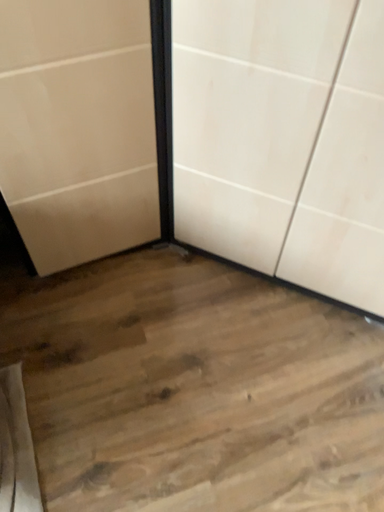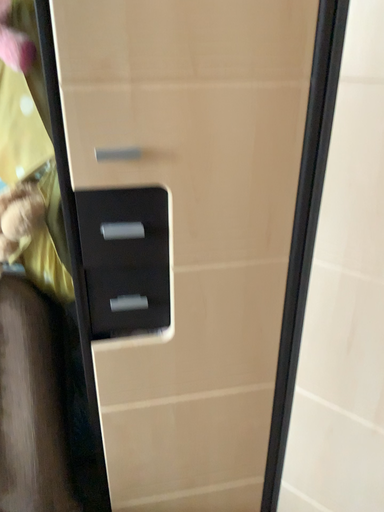
Question: How did the camera likely rotate when shooting the video?

Choices:
 (A) rotated upward
 (B) rotated downward

Answer: (A)